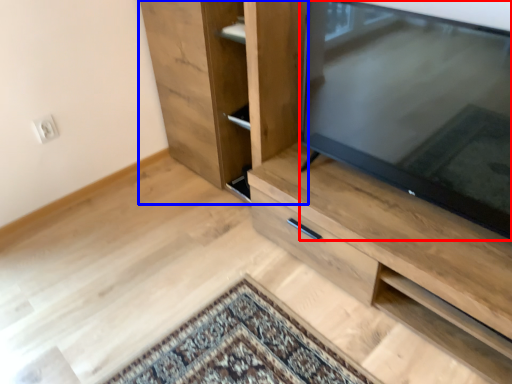
Question: Among these objects, which one is farthest to the camera, television (highlighted by a red box) or cupboard (highlighted by a blue box)?

Choices:
 (A) television
 (B) cupboard

Answer: (B)